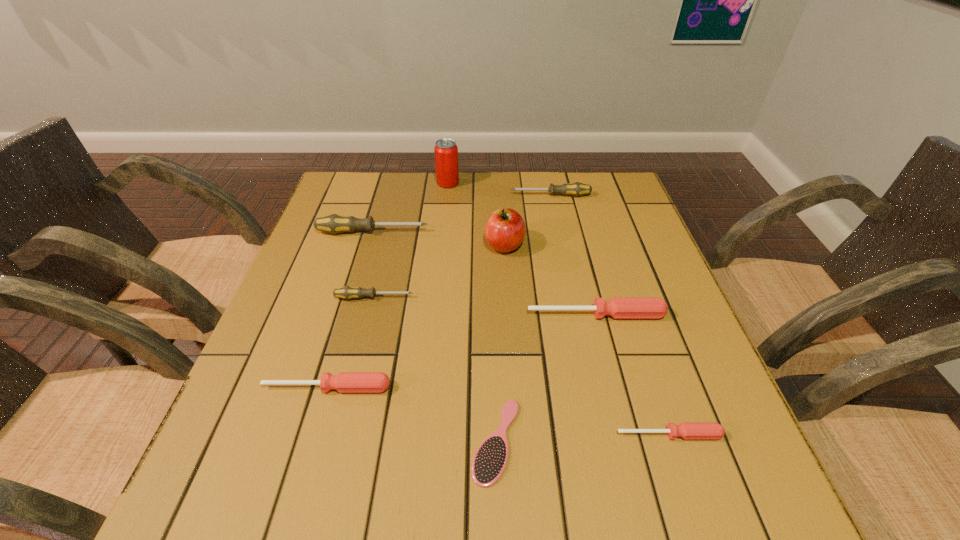
At what (x,y) coordinates should I click in order to perform the action: click on free space located 0.180m at the tip of the farthest screwdriver. Please return your answer as a coordinate pair (x, y). Image resolution: width=960 pixels, height=540 pixels. Looking at the image, I should click on (449, 195).

This screenshot has width=960, height=540. In order to click on vacant space located at the tip of the farthest screwdriver in this screenshot , I will do `click(483, 195)`.

Where is `free point located at the tip of the farthest screwdriver`? free point located at the tip of the farthest screwdriver is located at coordinates (467, 195).

This screenshot has width=960, height=540. Identify the location of vacant space positioned 0.240m on the left of the third nearest screwdriver. (418, 315).

At what (x,y) coordinates should I click in order to perform the action: click on blank space located 0.310m on the back of the fifth farthest screwdriver. Please return your answer as a coordinate pair (x, y). Looking at the image, I should click on (361, 271).

In order to click on blank area located at the tip of the nearest gray screwdriver in this screenshot , I will do `click(463, 298)`.

Locate an element on the screen. vacant space situated on the left of the smallest red screwdriver is located at coordinates (564, 435).

I want to click on free space located 0.100m on the left of the shortest object, so click(414, 441).

Locate an element on the screen. The height and width of the screenshot is (540, 960). can present at the far edge is located at coordinates (446, 151).

You are a GUI agent. You are given a task and a screenshot of the screen. Output one action in this format:
    pyautogui.click(x=<x>, y=<y>)
    Task: Click on the screwdriver that is at the far edge
    
    Given the screenshot: What is the action you would take?
    pyautogui.click(x=575, y=189)